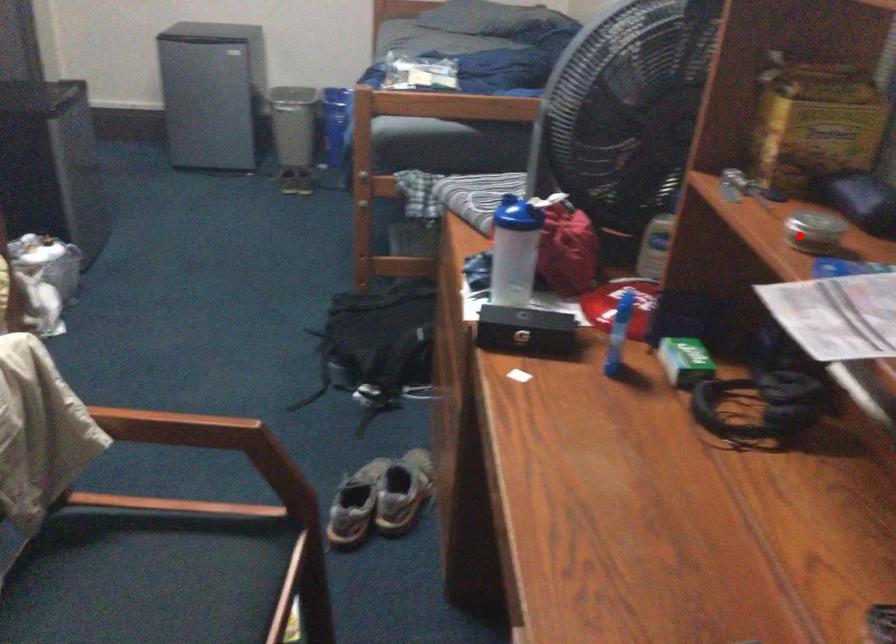
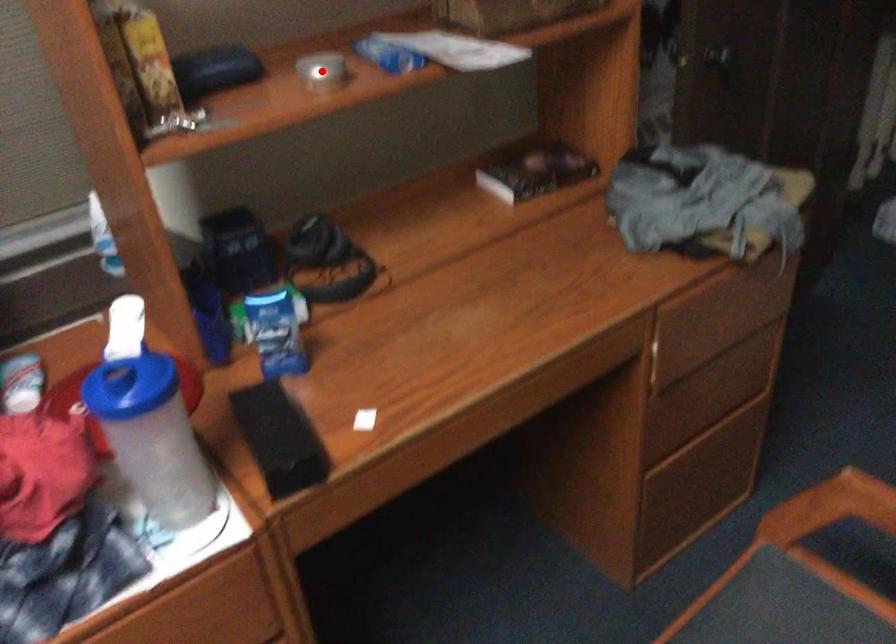
I am providing you with two images of the same scene from different viewpoints. A red point is marked on the first image and another point is marked on the second image. Does the point marked in image1 correspond to the same location as the one in image2?

Yes